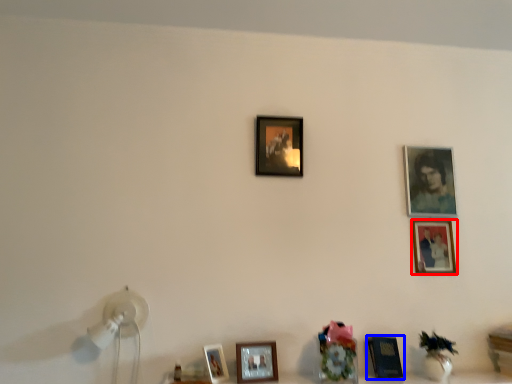
Question: Which of the following is the closest to the observer, picture frame (highlighted by a red box) or picture frame (highlighted by a blue box)?

Choices:
 (A) picture frame
 (B) picture frame

Answer: (B)